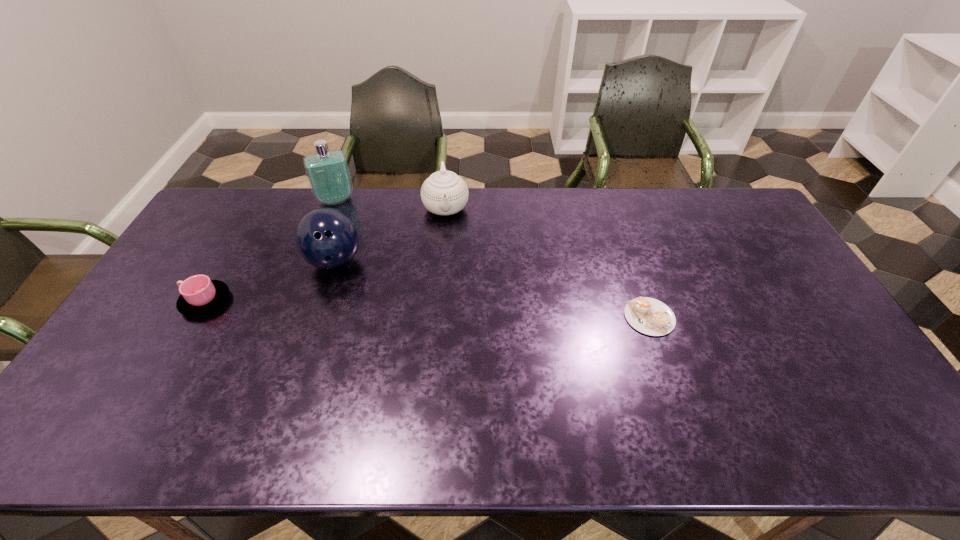
You are a GUI agent. You are given a task and a screenshot of the screen. Output one action in this format:
    pyautogui.click(x=<x>, y=<y>)
    Task: Click on the free space on the desktop that is between the cup and the rightmost object and is positioned on the surface of the third farthest object near the finger holes
    The image size is (960, 540).
    Given the screenshot: What is the action you would take?
    pos(364,307)

I want to click on vacant space on the desktop that is between the fourth tallest object and the shortest object and is positioned on the front label of the perfume, so click(368, 307).

Where is `free space on the desktop that is between the cup and the shortest object and is positioned on the spout of the second object from right to left`? free space on the desktop that is between the cup and the shortest object and is positioned on the spout of the second object from right to left is located at coordinates (453, 310).